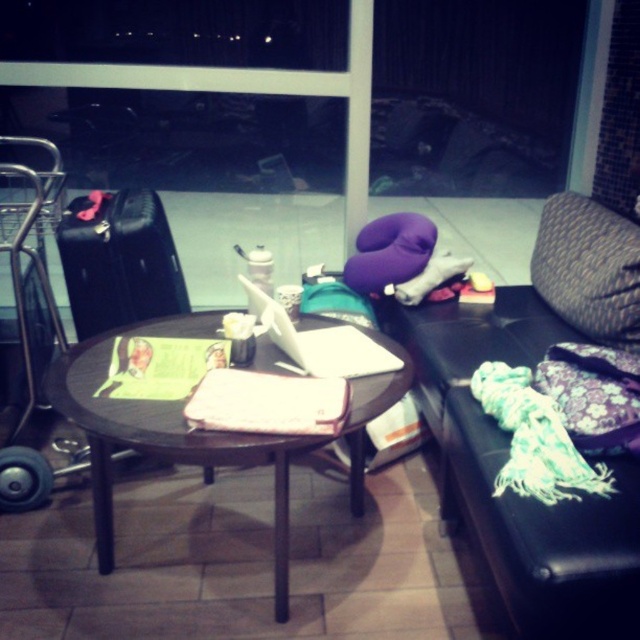
Question: Does wooden table at center have a lesser width compared to transparent glass door at upper center?

Choices:
 (A) yes
 (B) no

Answer: (A)

Question: Which is farther from the black leather suitcase at left?

Choices:
 (A) wooden table at center
 (B) teal fabric armchair at lower right
 (C) transparent glass door at upper center

Answer: (B)

Question: Which point is closer to the camera?

Choices:
 (A) (360, 108)
 (B) (481, 472)
 (C) (97, 276)
 (D) (141, 408)

Answer: (D)

Question: Among these objects, which one is nearest to the camera?

Choices:
 (A) teal fabric armchair at lower right
 (B) wooden table at center
 (C) transparent glass door at upper center
 (D) black leather suitcase at left

Answer: (A)

Question: From the image, what is the correct spatial relationship of teal fabric armchair at lower right in relation to wooden table at center?

Choices:
 (A) left
 (B) right

Answer: (B)

Question: Is black leather suitcase at left further to the viewer compared to transparent glass door at upper center?

Choices:
 (A) no
 (B) yes

Answer: (A)